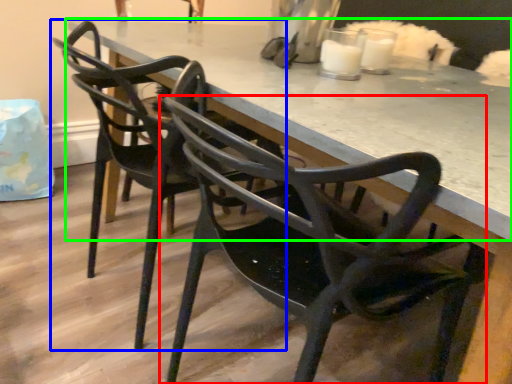
Question: Estimate the real-world distances between objects in this image. Which object is closer to chair (highlighted by a red box), chair (highlighted by a blue box) or table (highlighted by a green box)?

Choices:
 (A) chair
 (B) table

Answer: (B)